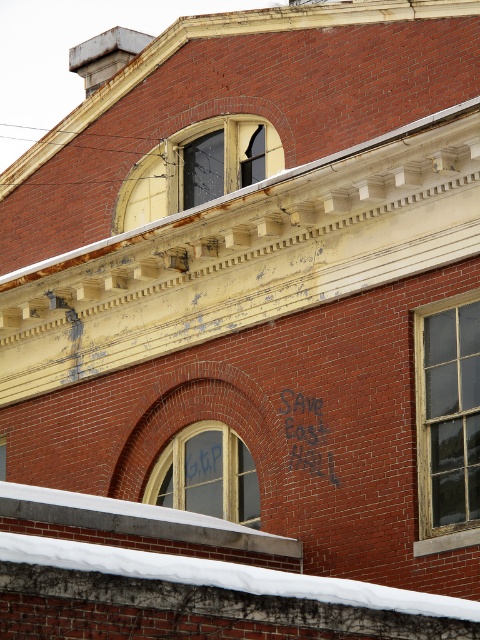
Which of these two, wooden window at right or dark glass window at upper center, stands shorter?

dark glass window at upper center

Does point (455, 506) lie behind point (149, 164)?

No.

Find the location of a particular element. Image resolution: width=480 pixels, height=640 pixels. wooden window at right is located at coordinates (447, 422).

Which of these two, dark glass window at upper center or wooden window at center, stands taller?

wooden window at center

Who is more forward, (196, 124) or (191, 432)?

Positioned in front is point (191, 432).

Where is `dark glass window at upper center`? dark glass window at upper center is located at coordinates (197, 168).

Is wooden window at right in front of wooden window at center?

That is True.

Is wooden window at right to the right of wooden window at center from the viewer's perspective?

Indeed, wooden window at right is positioned on the right side of wooden window at center.

Where is `wooden window at right`? wooden window at right is located at coordinates (447, 422).